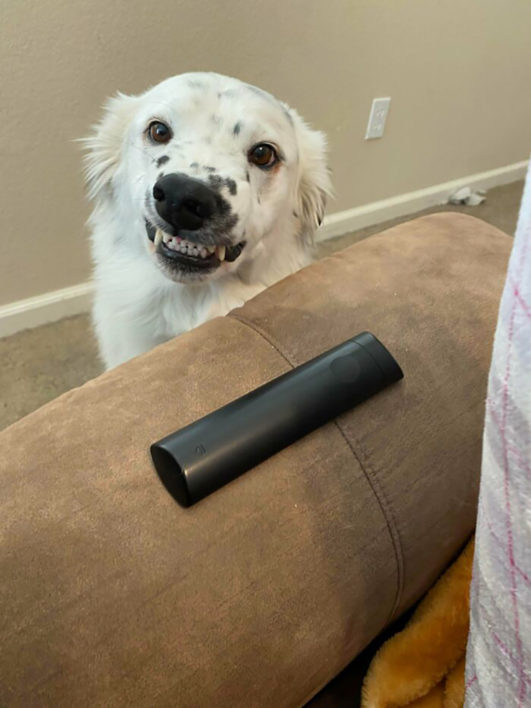
Where is `carpet`? carpet is located at coordinates click(49, 384).